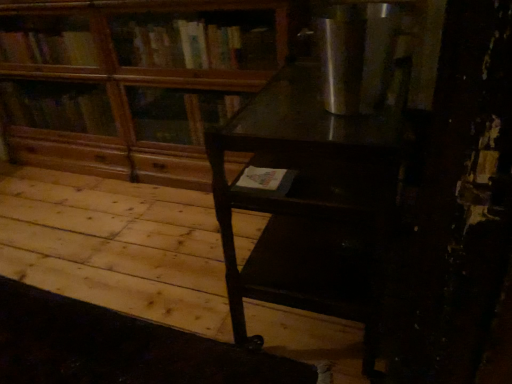
Question: Could you tell me if dark wood table at center is facing wooden bookcase at center?

Choices:
 (A) no
 (B) yes

Answer: (B)

Question: Considering the relative sizes of dark wood table at center and wooden bookcase at center in the image provided, is dark wood table at center shorter than wooden bookcase at center?

Choices:
 (A) no
 (B) yes

Answer: (B)

Question: Is the surface of dark wood table at center in direct contact with wooden bookcase at center?

Choices:
 (A) yes
 (B) no

Answer: (B)

Question: From the image's perspective, does dark wood table at center appear higher than wooden bookcase at center?

Choices:
 (A) yes
 (B) no

Answer: (B)

Question: Can you confirm if dark wood table at center is thinner than wooden bookcase at center?

Choices:
 (A) no
 (B) yes

Answer: (A)

Question: Is wooden bookcase at center located within dark wood table at center?

Choices:
 (A) yes
 (B) no

Answer: (B)

Question: Is wooden bookcase at center turned away from dark wood table at center?

Choices:
 (A) yes
 (B) no

Answer: (B)

Question: Does wooden bookcase at center have a larger size compared to dark wood table at center?

Choices:
 (A) no
 (B) yes

Answer: (B)

Question: Is wooden bookcase at center beside dark wood table at center?

Choices:
 (A) no
 (B) yes

Answer: (A)

Question: Is wooden bookcase at center aimed at dark wood table at center?

Choices:
 (A) no
 (B) yes

Answer: (B)

Question: Is there a large distance between wooden bookcase at center and dark wood table at center?

Choices:
 (A) yes
 (B) no

Answer: (B)

Question: Does wooden bookcase at center have a greater width compared to dark wood table at center?

Choices:
 (A) no
 (B) yes

Answer: (A)

Question: Is dark wood table at center inside or outside of wooden bookcase at center?

Choices:
 (A) inside
 (B) outside

Answer: (B)